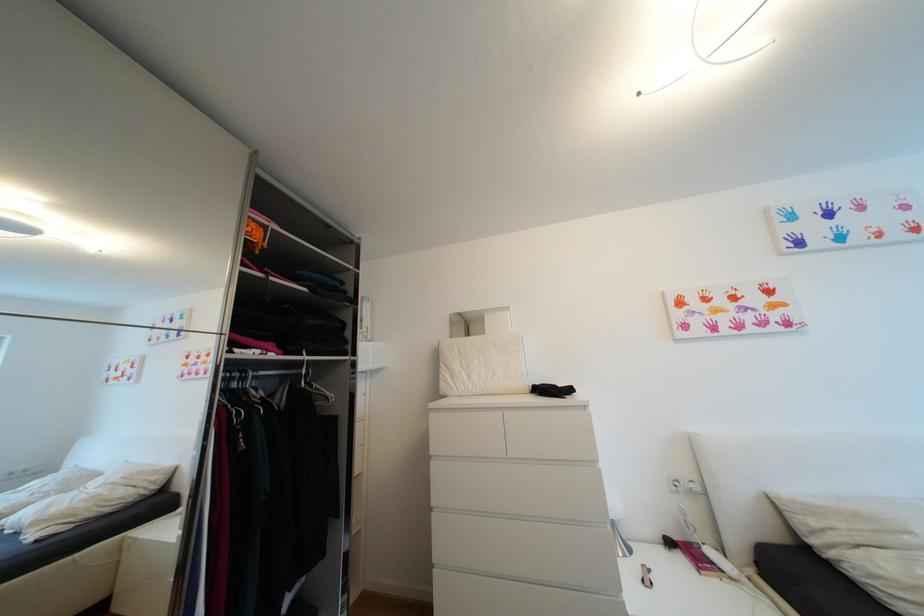
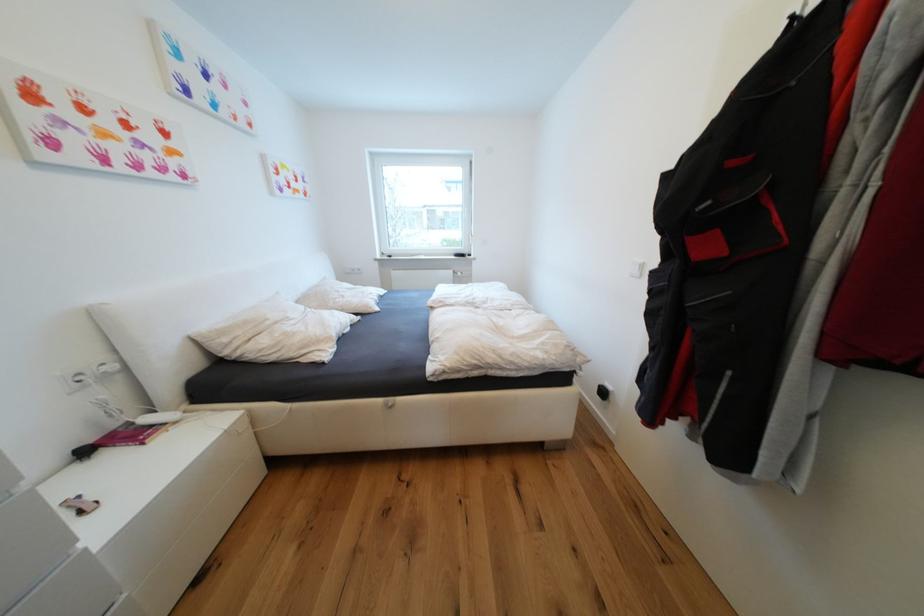
Find the pixel in the second image that matches the point at 821,524 in the first image.

(233, 341)